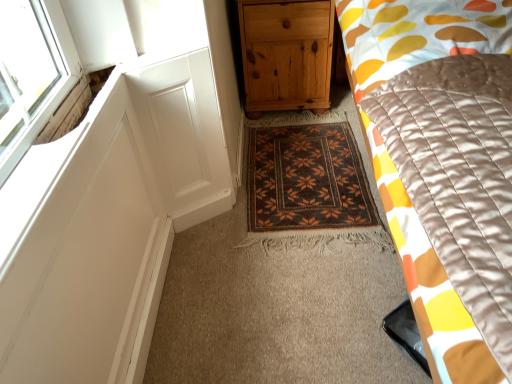
Question: Should I look upward or downward to see brown woven mat at center?

Choices:
 (A) down
 (B) up

Answer: (B)

Question: Considering the relative sizes of brown woven mat at center and silky yellow-orange quilt at right in the image provided, is brown woven mat at center taller than silky yellow-orange quilt at right?

Choices:
 (A) yes
 (B) no

Answer: (B)

Question: Could silky yellow-orange quilt at right be considered to be inside brown woven mat at center?

Choices:
 (A) no
 (B) yes

Answer: (A)

Question: Does brown woven mat at center have a lesser width compared to silky yellow-orange quilt at right?

Choices:
 (A) yes
 (B) no

Answer: (A)

Question: Is brown woven mat at center facing towards silky yellow-orange quilt at right?

Choices:
 (A) yes
 (B) no

Answer: (B)

Question: Would you consider brown woven mat at center to be distant from silky yellow-orange quilt at right?

Choices:
 (A) no
 (B) yes

Answer: (A)

Question: Is brown woven mat at center turned away from silky yellow-orange quilt at right?

Choices:
 (A) no
 (B) yes

Answer: (A)

Question: Is silky yellow-orange quilt at right at the left side of natural wood chest of drawers at center?

Choices:
 (A) no
 (B) yes

Answer: (A)

Question: Is silky yellow-orange quilt at right at the right side of natural wood chest of drawers at center?

Choices:
 (A) yes
 (B) no

Answer: (A)

Question: Is silky yellow-orange quilt at right closer to the viewer compared to natural wood chest of drawers at center?

Choices:
 (A) no
 (B) yes

Answer: (B)

Question: Does silky yellow-orange quilt at right have a lesser height compared to natural wood chest of drawers at center?

Choices:
 (A) no
 (B) yes

Answer: (A)

Question: From a real-world perspective, is silky yellow-orange quilt at right beneath natural wood chest of drawers at center?

Choices:
 (A) yes
 (B) no

Answer: (B)

Question: Is silky yellow-orange quilt at right wider than natural wood chest of drawers at center?

Choices:
 (A) no
 (B) yes

Answer: (B)

Question: Is silky yellow-orange quilt at right at the back of natural wood chest of drawers at center?

Choices:
 (A) yes
 (B) no

Answer: (B)